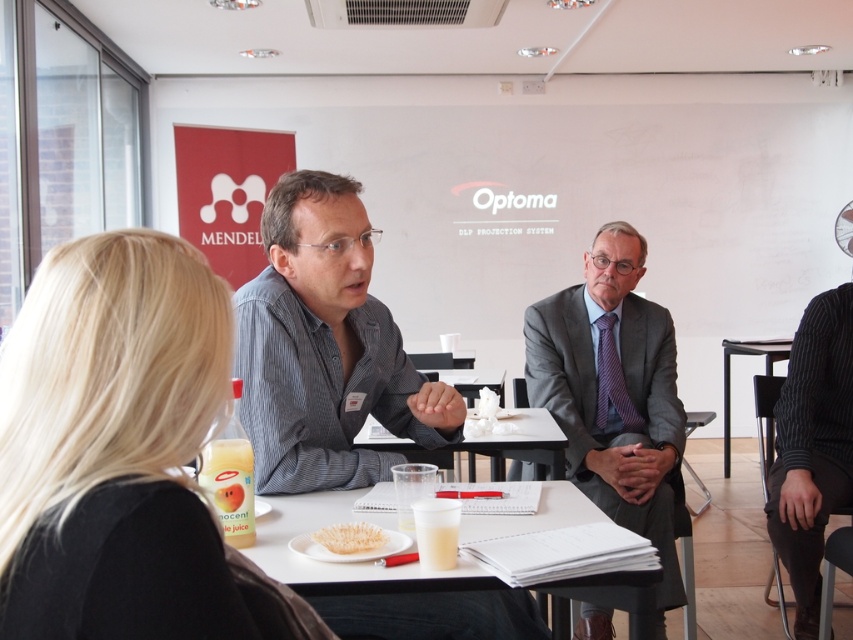
Is blonde hair at upper left above white paper at center?

Yes, blonde hair at upper left is above white paper at center.

Does point (235, 632) come in front of point (549, 484)?

Yes.

You are a GUI agent. You are given a task and a screenshot of the screen. Output one action in this format:
    pyautogui.click(x=<x>, y=<y>)
    Task: Click on the blonde hair at upper left
    The height and width of the screenshot is (640, 853).
    Given the screenshot: What is the action you would take?
    pyautogui.click(x=122, y=452)

Does gray striped shirt at center appear over white plastic table at center?

Correct, gray striped shirt at center is located above white plastic table at center.

Who is higher up, gray striped shirt at center or white plastic table at center?

Positioned higher is gray striped shirt at center.

The image size is (853, 640). I want to click on gray striped shirt at center, so click(x=325, y=348).

Where is `gray striped shirt at center`? The width and height of the screenshot is (853, 640). gray striped shirt at center is located at coordinates (325, 348).

Does blonde hair at upper left appear under gray striped shirt at center?

Correct, blonde hair at upper left is located below gray striped shirt at center.

Does point (125, 248) come behind point (288, 300)?

No, (125, 248) is in front of (288, 300).

I want to click on blonde hair at upper left, so click(x=122, y=452).